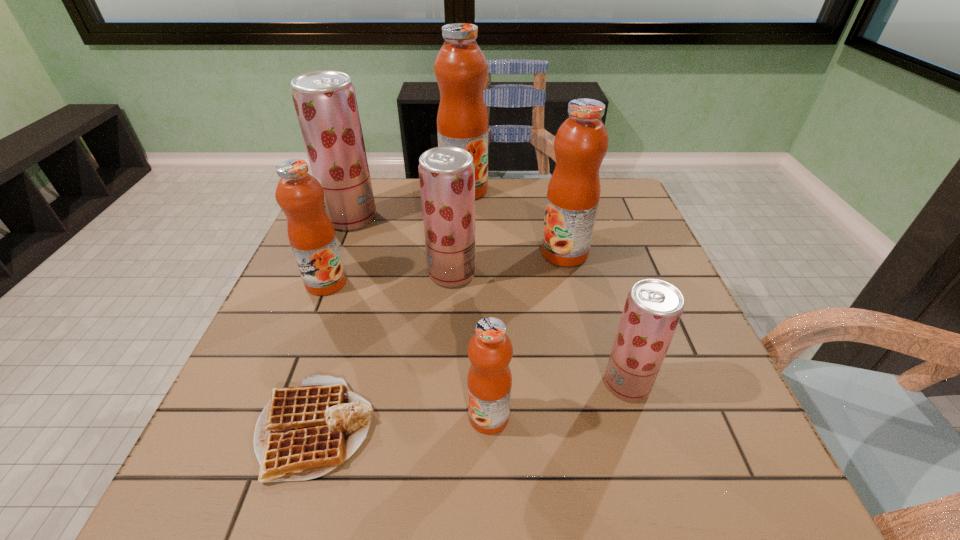
This screenshot has width=960, height=540. I want to click on object situated at the near left corner, so click(304, 432).

The image size is (960, 540). What are the coordinates of `blank space at the far edge` in the screenshot? It's located at (522, 187).

Identify the location of free space at the near edge of the desktop. This screenshot has width=960, height=540. (585, 473).

Locate an element on the screen. The width and height of the screenshot is (960, 540). free spot at the left edge of the desktop is located at coordinates pyautogui.click(x=262, y=352).

Find the location of a particular element. The width and height of the screenshot is (960, 540). vacant space at the far right corner of the desktop is located at coordinates (626, 209).

The image size is (960, 540). In order to click on blank region between the smallest strawberry fruit juice and the tallest fruit juice in this screenshot , I will do `click(545, 287)`.

You are a GUI agent. You are given a task and a screenshot of the screen. Output one action in this format:
    pyautogui.click(x=<x>, y=<y>)
    Task: Click on the empty space between the farthest object and the second farthest fruit juice
    This screenshot has height=540, width=960.
    Given the screenshot: What is the action you would take?
    pyautogui.click(x=408, y=204)

Identify the location of empty space between the biggest strawberry fruit juice and the farthest object. (408, 204).

You are a GUI agent. You are given a task and a screenshot of the screen. Output one action in this format:
    pyautogui.click(x=<x>, y=<y>)
    Task: Click on the unoccupied position between the farthest orange fruit juice and the shortest object
    The width and height of the screenshot is (960, 540).
    Given the screenshot: What is the action you would take?
    pyautogui.click(x=390, y=309)

Find the location of `free spot between the biggest orange fruit juice and the waffle`. free spot between the biggest orange fruit juice and the waffle is located at coordinates (390, 309).